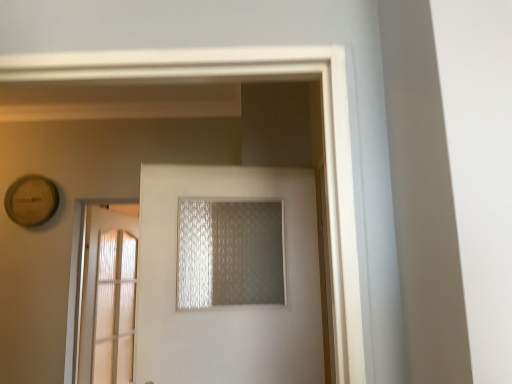
Question: From a real-world perspective, relative to white frosted glass door at center, arranged as the 1th door when viewed from the front, is clear glass door at left, which is counted as the second door, starting from the front, vertically above or below?

Choices:
 (A) below
 (B) above

Answer: (A)

Question: In terms of height, does clear glass door at left, the first door in the back-to-front sequence, look taller or shorter compared to white frosted glass door at center, which is the second door from left to right?

Choices:
 (A) tall
 (B) short

Answer: (A)

Question: Which of these objects is positioned closest to the translucent textured glass at center?

Choices:
 (A) clear glass door at left, marked as the 1th door in a left-to-right arrangement
 (B) white frosted glass door at center, arranged as the 1th door when viewed from the front

Answer: (B)

Question: Which of these objects is positioned closest to the translucent textured glass at center?

Choices:
 (A) white frosted glass door at center, which is counted as the first door, starting from the right
 (B) clear glass door at left, positioned as the 2th door in right-to-left order

Answer: (A)